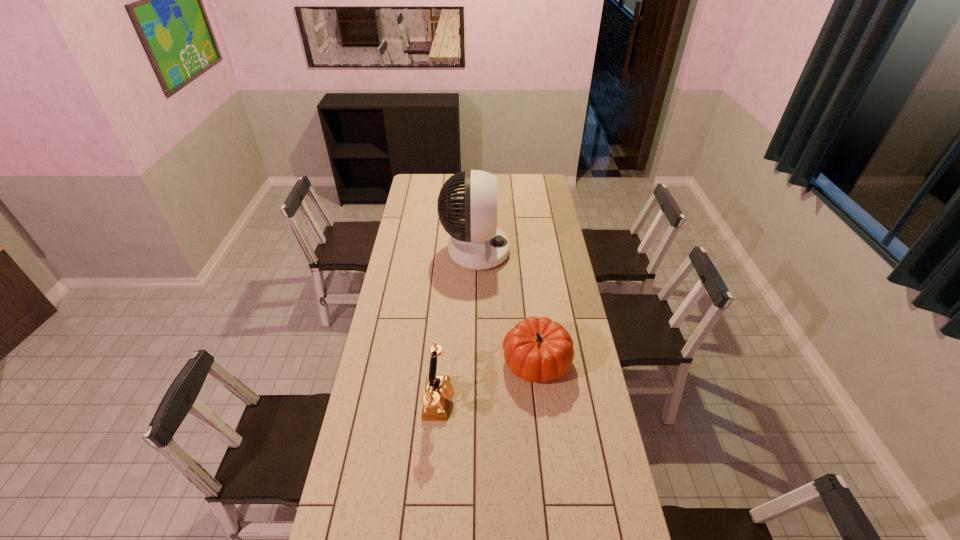
I want to click on blank space that satisfies the following two spatial constraints: 1. on the grille of the farthest object; 2. on the left side of the pumpkin, so click(x=474, y=362).